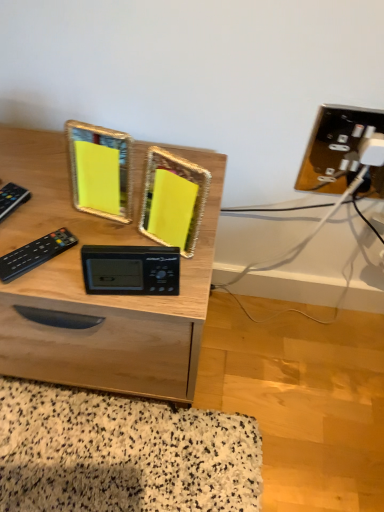
Find the location of `vacant area that is situated to the right of black plastic remote at left, the 1th control viewed from the left`. vacant area that is situated to the right of black plastic remote at left, the 1th control viewed from the left is located at coordinates (51, 238).